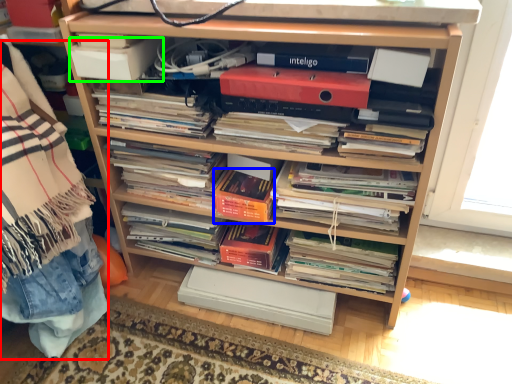
Question: Estimate the real-world distances between objects in this image. Which object is closer to material (highlighted by a red box), paperback book (highlighted by a blue box) or paperback book (highlighted by a green box)?

Choices:
 (A) paperback book
 (B) paperback book

Answer: (B)